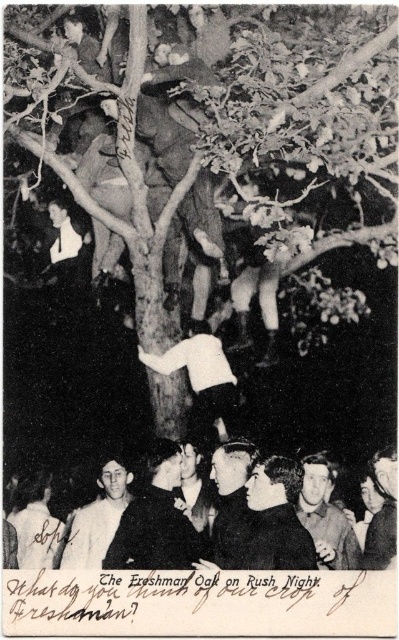
Is white matte shirt at center closer to camera compared to smooth leather jacket at center?

No, it is behind smooth leather jacket at center.

Does white matte shirt at center have a lesser width compared to smooth leather jacket at center?

No, white matte shirt at center is not thinner than smooth leather jacket at center.

Locate an element on the screen. The width and height of the screenshot is (399, 640). white matte shirt at center is located at coordinates (201, 376).

Does dark clothing group at lower center have a lesser width compared to smooth leather jacket at center?

In fact, dark clothing group at lower center might be wider than smooth leather jacket at center.

Is point (260, 515) closer to viewer compared to point (185, 442)?

Yes, point (260, 515) is closer to viewer.

Is point (177, 518) behind point (209, 500)?

No, it is not.

The width and height of the screenshot is (399, 640). Find the location of `dark clothing group at lower center`. dark clothing group at lower center is located at coordinates (284, 486).

Can you confirm if white matte shirt at center is bigger than smooth black shirt at lower left?

Yes, white matte shirt at center is bigger than smooth black shirt at lower left.

Can you confirm if white matte shirt at center is smaller than smooth black shirt at lower left?

No, white matte shirt at center is not smaller than smooth black shirt at lower left.

In the scene shown: Who is more forward, (195, 403) or (92, 564)?

Point (92, 564)

Identify the location of white matte shirt at center. This screenshot has height=640, width=399. tap(201, 376).